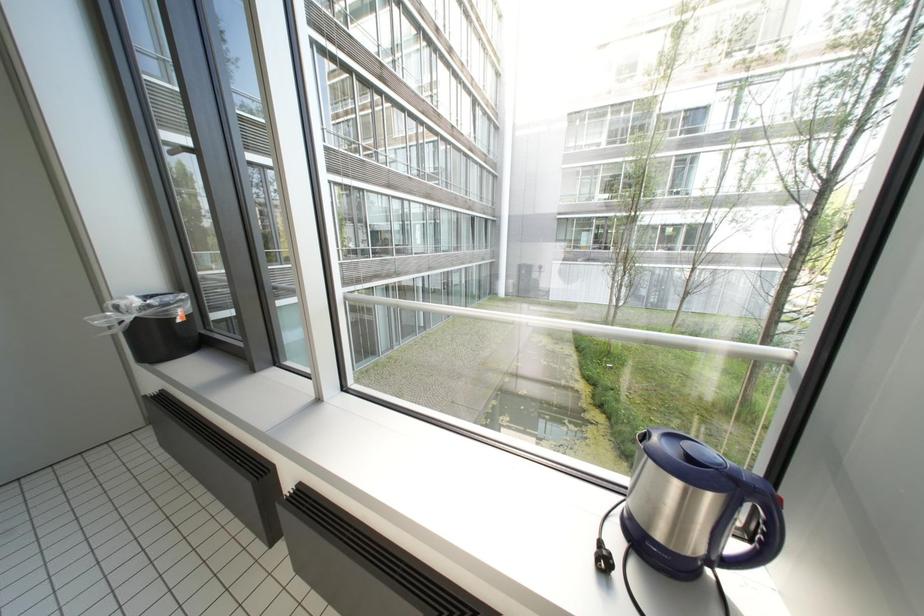
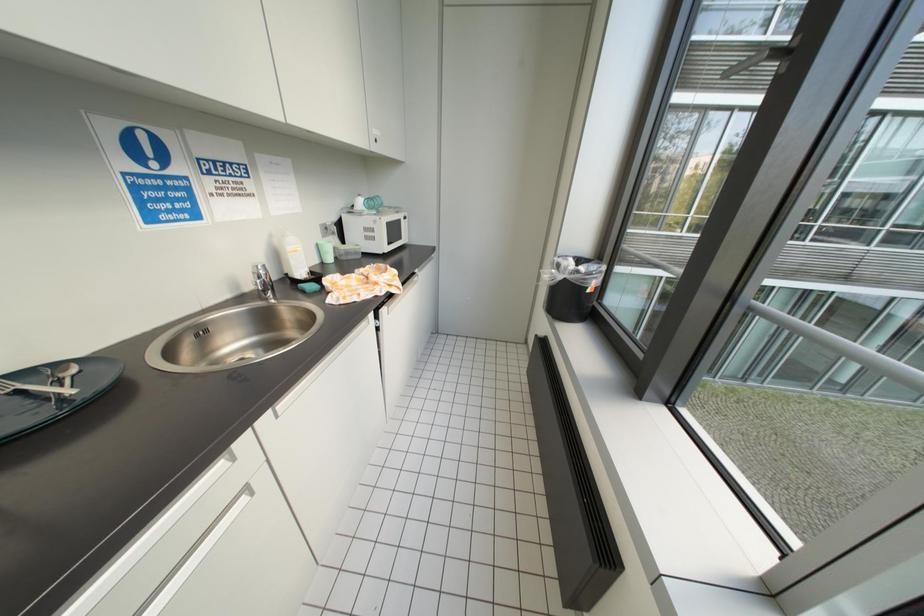
Based on the continuous images, in which direction is the camera rotating?

The camera's rotation is toward left-down.